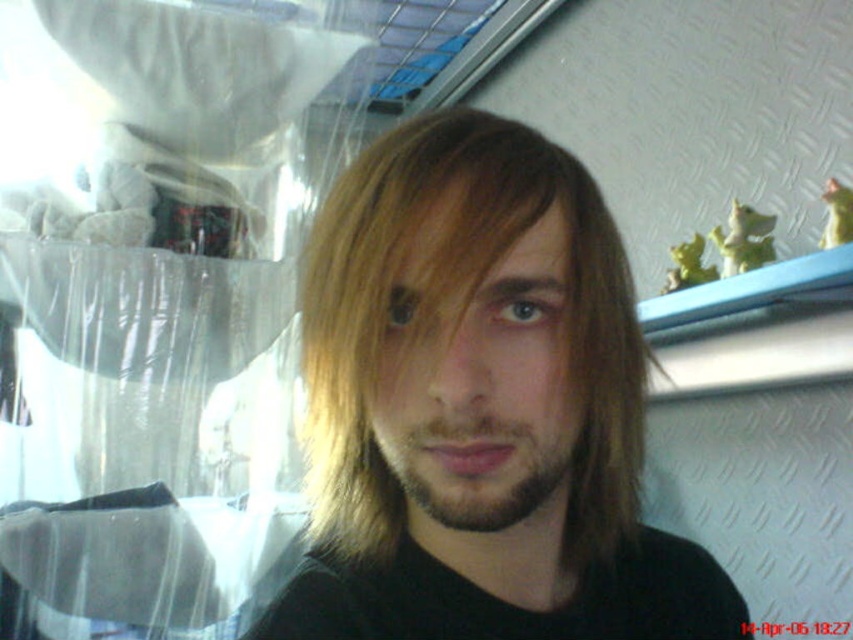
Is point (379, 214) farther from camera compared to point (553, 428)?

That is False.

Is point (578, 509) closer to viewer compared to point (456, 426)?

No.

Is point (405, 228) positioned behind point (541, 474)?

No, (405, 228) is closer to viewer.

The height and width of the screenshot is (640, 853). What are the coordinates of `blondehair at center` in the screenshot? It's located at (460, 317).